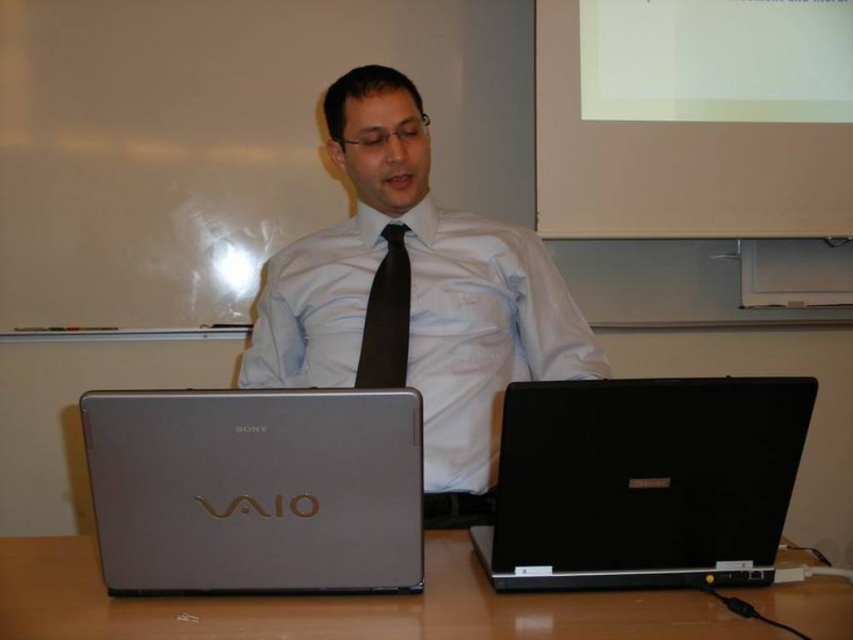
Question: Can you confirm if matte silver laptop at center is bigger than black satin tie at center?

Choices:
 (A) yes
 (B) no

Answer: (A)

Question: Which object appears farthest from the camera in this image?

Choices:
 (A) black matte laptop at lower right
 (B) silver metallic vaio laptop at center
 (C) black satin tie at center

Answer: (C)

Question: Which object is farther from the camera taking this photo?

Choices:
 (A) matte silver laptop at center
 (B) black satin tie at center

Answer: (B)

Question: Can you confirm if matte silver laptop at center is wider than wooden table at lower center?

Choices:
 (A) yes
 (B) no

Answer: (B)

Question: Among these points, which one is farthest from the camera?

Choices:
 (A) (383, 344)
 (B) (415, 589)
 (C) (631, 580)
 (D) (354, 244)

Answer: (D)

Question: Is matte silver laptop at center smaller than black matte laptop at lower right?

Choices:
 (A) no
 (B) yes

Answer: (A)